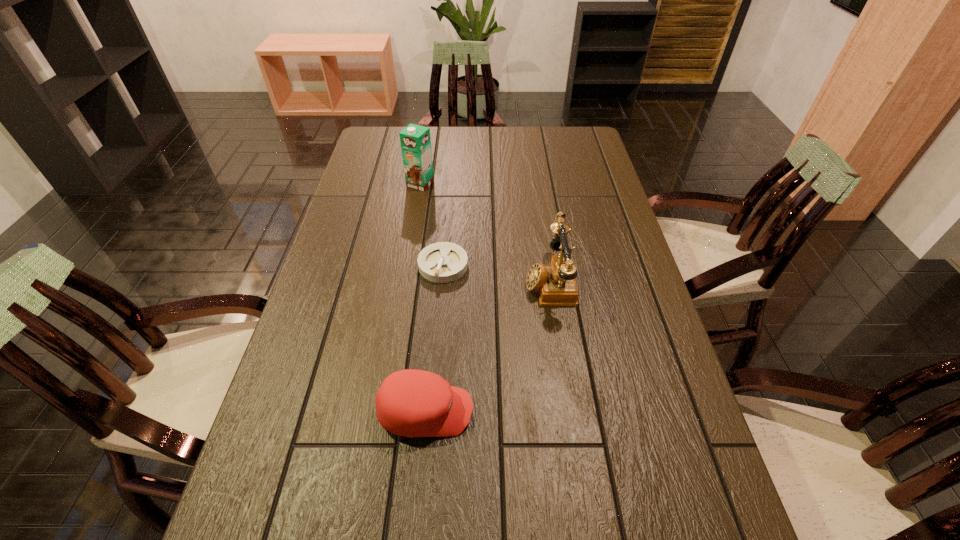
This screenshot has height=540, width=960. In order to click on the farthest object in this screenshot , I will do `click(415, 140)`.

I want to click on telephone, so click(556, 284).

Image resolution: width=960 pixels, height=540 pixels. I want to click on the third shortest object, so click(x=556, y=284).

At what (x,y) coordinates should I click in order to perform the action: click on the third tallest object. Please return your answer as a coordinate pair (x, y). This screenshot has width=960, height=540. Looking at the image, I should click on (412, 403).

I want to click on cap, so click(x=412, y=403).

This screenshot has width=960, height=540. I want to click on ashtray, so click(442, 262).

Locate an element on the screen. This screenshot has width=960, height=540. free location located 0.250m on the front of the carton is located at coordinates (411, 240).

Locate an element on the screen. This screenshot has width=960, height=540. vacant space located 0.200m on the dial number of the second tallest object is located at coordinates (452, 281).

Find the location of a particular element. The width and height of the screenshot is (960, 540). vacant area located 0.280m on the dial number of the second tallest object is located at coordinates (422, 281).

Where is `vacant area situated 0.170m on the dial number of the second tallest object`? The image size is (960, 540). vacant area situated 0.170m on the dial number of the second tallest object is located at coordinates (463, 281).